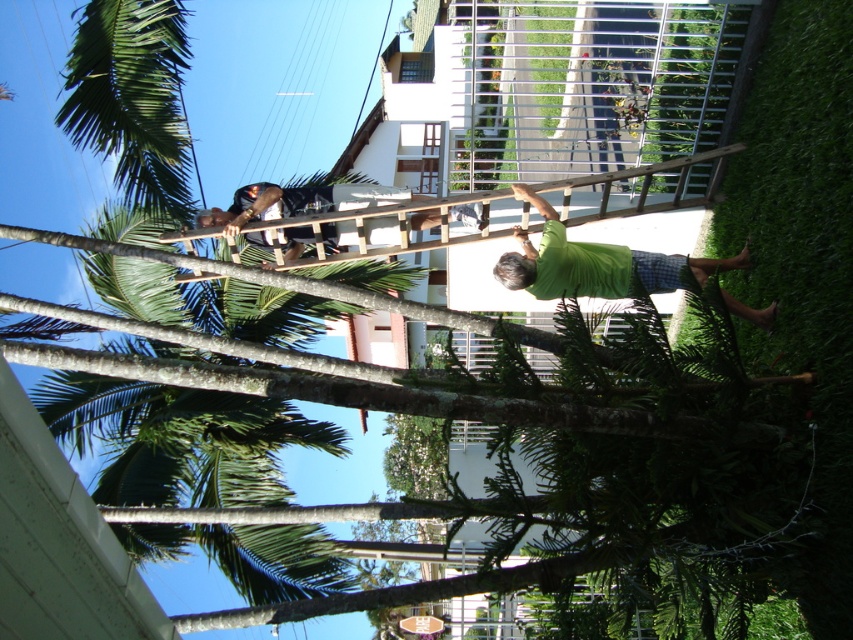
Question: Can you confirm if green matte shirt at lower right is positioned below wooden ladder at upper center?

Choices:
 (A) yes
 (B) no

Answer: (A)

Question: Is green matte shirt at lower right to the right of wooden ladder at upper center from the viewer's perspective?

Choices:
 (A) no
 (B) yes

Answer: (B)

Question: Is green matte shirt at lower right positioned before wooden ladder at upper center?

Choices:
 (A) yes
 (B) no

Answer: (A)

Question: Among these points, which one is farthest from the camera?

Choices:
 (A) (758, 310)
 (B) (415, 225)

Answer: (B)

Question: Which of the following is the farthest from the observer?

Choices:
 (A) wooden ladder at upper center
 (B) green matte shirt at lower right

Answer: (A)